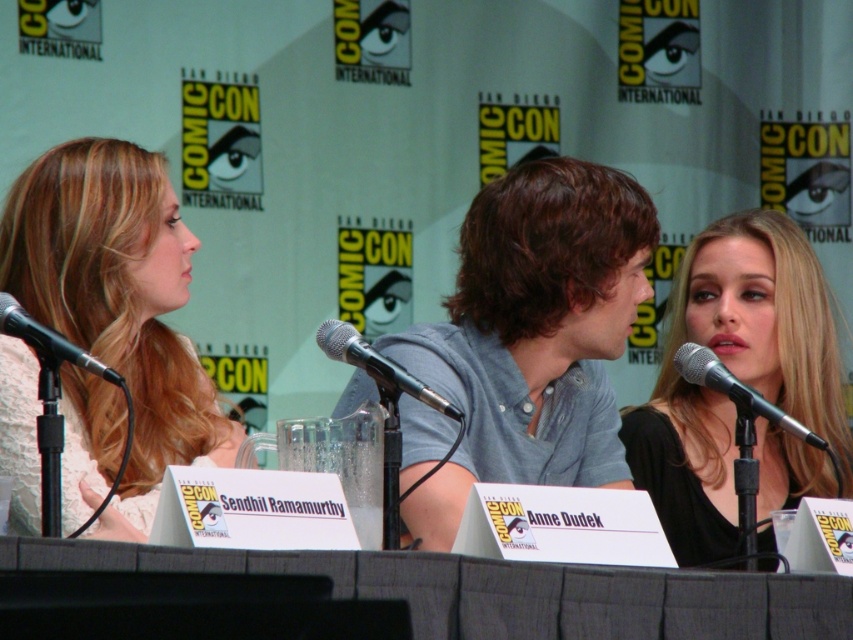
Measure the distance between point (628, 448) and camera.

Point (628, 448) and camera are 4.19 meters apart from each other.

Between point (669, 448) and point (457, 410), which one is positioned behind?

The point (669, 448) is more distant.

Image resolution: width=853 pixels, height=640 pixels. Identify the location of black matte dress at center. (x=735, y=372).

Does black matte dress at center have a greater width compared to black metallic microphone at left?

Indeed, black matte dress at center has a greater width compared to black metallic microphone at left.

Is black matte dress at center further to camera compared to black metallic microphone at left?

That is True.

The height and width of the screenshot is (640, 853). What do you see at coordinates (735, 372) in the screenshot?
I see `black matte dress at center` at bounding box center [735, 372].

The width and height of the screenshot is (853, 640). Find the location of `black matte dress at center`. black matte dress at center is located at coordinates (735, 372).

Who is more forward, (795,420) or (41,339)?

Point (41,339)

Can you confirm if black metallic microphone at right is positioned to the right of black metallic microphone at left?

Indeed, black metallic microphone at right is positioned on the right side of black metallic microphone at left.

Where is `black metallic microphone at right`? The width and height of the screenshot is (853, 640). black metallic microphone at right is located at coordinates (738, 392).